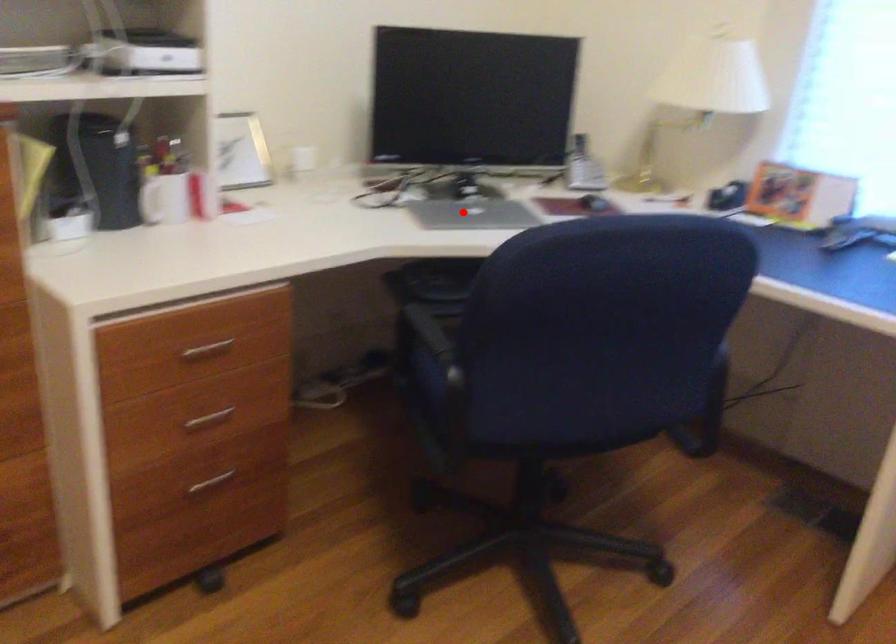
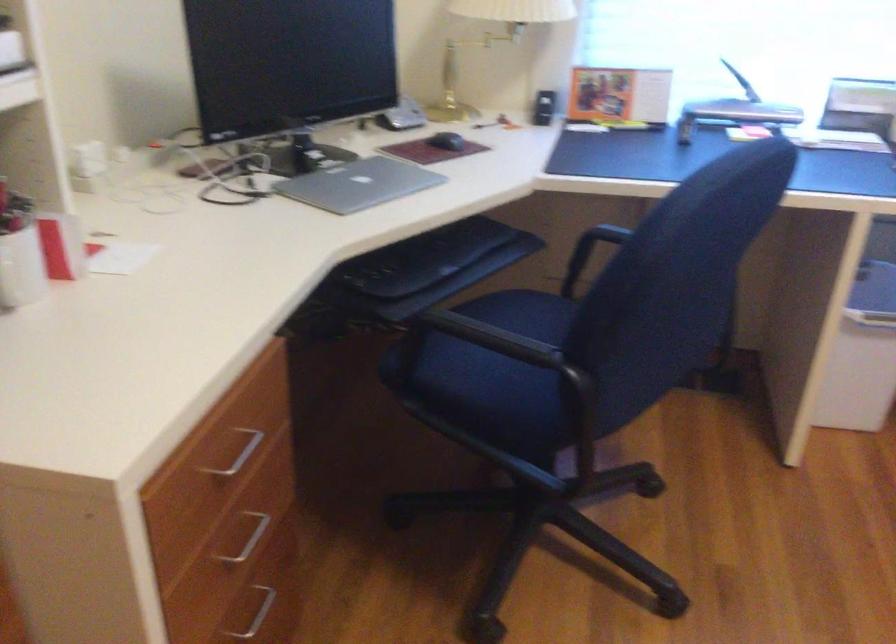
Question: A red point is marked in image1. In image2, is the corresponding 3D point closer to the camera or farther? Reply with the corresponding letter.

Choices:
 (A) The corresponding 3D point is closer.
 (B) The corresponding 3D point is farther.

Answer: (A)